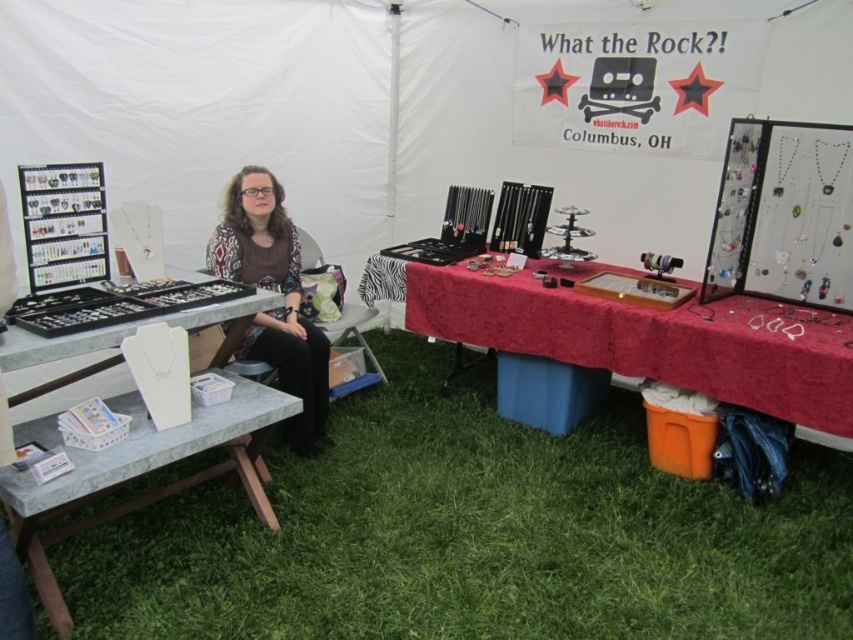
In the scene shown: Does velvet red table at center appear on the left side of matte black sweater at center?

No, velvet red table at center is not to the left of matte black sweater at center.

This screenshot has height=640, width=853. I want to click on velvet red table at center, so click(642, 337).

Who is lower down, metallic gray table at lower left or matte black sweater at center?

metallic gray table at lower left is lower down.

Does metallic gray table at lower left appear under matte black sweater at center?

Correct, metallic gray table at lower left is located below matte black sweater at center.

Locate an element on the screen. metallic gray table at lower left is located at coordinates coord(142,472).

Which is behind, point (485, 392) or point (751, 339)?

Positioned behind is point (485, 392).

Is green grass at lower center positioned behind velvet red table at center?

A: That is False.

Locate an element on the screen. The image size is (853, 640). green grass at lower center is located at coordinates (473, 534).